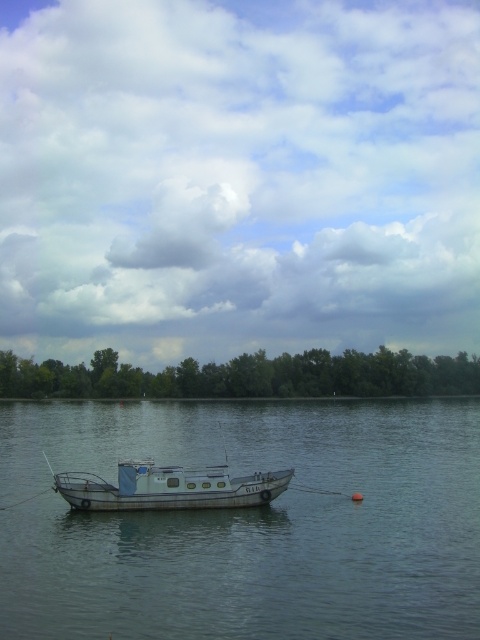
Does smooth gray water at center come in front of white matte boat at center?

Yes.

Looking at this image, is smooth gray water at center bigger than white matte boat at center?

Yes.

Does point (300, 586) come farther from viewer compared to point (205, 474)?

No, (300, 586) is closer to viewer.

Locate an element on the screen. smooth gray water at center is located at coordinates (247, 522).

Is cloudy sky at upper center smaller than white matte boat at center?

Actually, cloudy sky at upper center might be larger than white matte boat at center.

The height and width of the screenshot is (640, 480). In order to click on cloudy sky at upper center in this screenshot , I will do `click(238, 177)`.

Which is behind, point (99, 264) or point (94, 515)?

Positioned behind is point (99, 264).

Does cloudy sky at upper center appear on the left side of smooth gray water at center?

Indeed, cloudy sky at upper center is positioned on the left side of smooth gray water at center.

Which is in front, point (160, 344) or point (248, 538)?

Point (248, 538) is more forward.

Where is `cloudy sky at upper center`? Image resolution: width=480 pixels, height=640 pixels. cloudy sky at upper center is located at coordinates (238, 177).